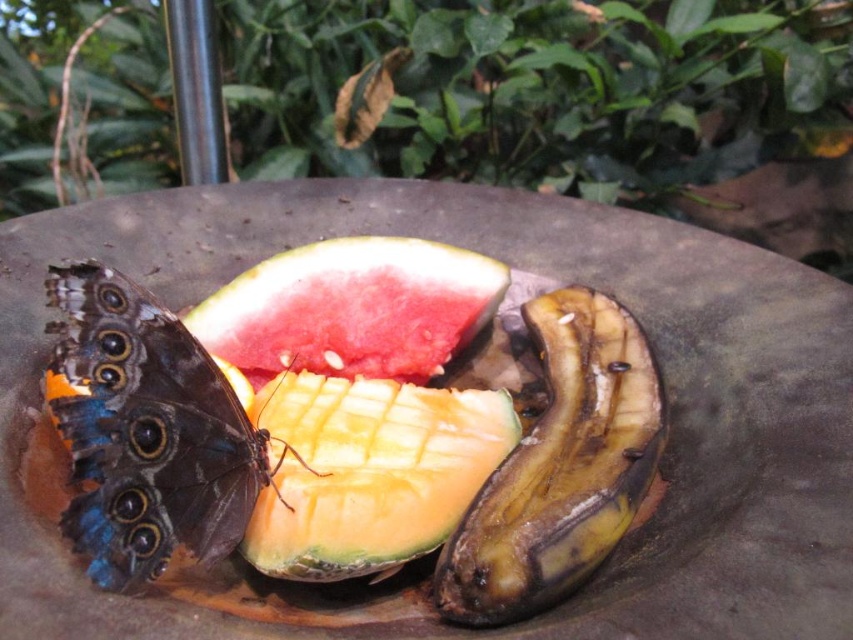
Question: Can you confirm if yellow-green fleshed melon at center is thinner than watermelon at center?

Choices:
 (A) no
 (B) yes

Answer: (B)

Question: Is blue iridescent wings at lower left below yellow-green fleshed melon at center?

Choices:
 (A) no
 (B) yes

Answer: (A)

Question: Among these objects, which one is nearest to the camera?

Choices:
 (A) watermelon at center
 (B) ripe yellowish-brown banana at center
 (C) yellow-green fleshed melon at center

Answer: (B)

Question: Does yellow-green fleshed melon at center have a greater width compared to watermelon at center?

Choices:
 (A) no
 (B) yes

Answer: (A)

Question: Which of these objects is positioned farthest from the ripe yellowish-brown banana at center?

Choices:
 (A) yellow-green fleshed melon at center
 (B) watermelon at center

Answer: (B)

Question: Estimate the real-world distances between objects in this image. Which object is farther from the yellow-green fleshed melon at center?

Choices:
 (A) watermelon at center
 (B) blue iridescent wings at lower left

Answer: (A)